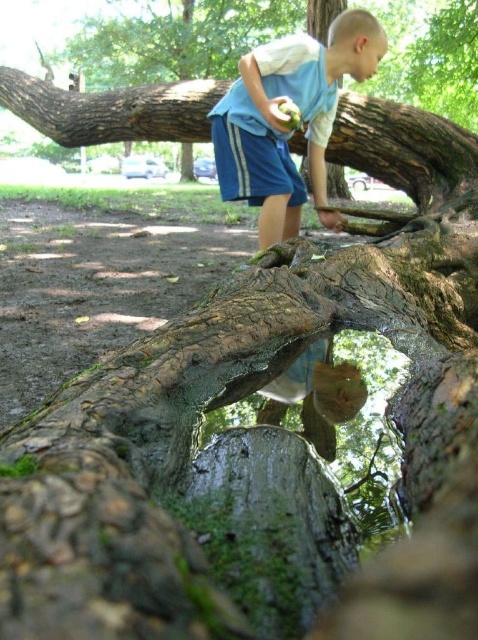
You are a photographer trying to capture the boy in the park scene. To ensure the blue cotton shorts at center are in focus, where should you aim your camera lens?

The blue cotton shorts at center are located at point coordinates of 0.186 on the x axis and 0.592 on the y axis, so aim your camera lens at those coordinates to ensure the shorts are in focus.

You are a park ranger assessing safety for visitors. The blue cotton shorts at center and the rough bark tree trunk at upper center are in the same area. Considering their widths, which object is wider?

The rough bark tree trunk at upper center is wider than the blue cotton shorts at center.

You are standing at the point marked as point (x=351, y=13) in the park. If you walk straight ahead, will you immediately encounter the large curved tree trunk shown in the scene?

The distance between you and the viewer is 1.92 meters, so if you walk straight ahead from point (x=351, y=13), you will immediately encounter the large curved tree trunk since it is only 1.92 meters away.